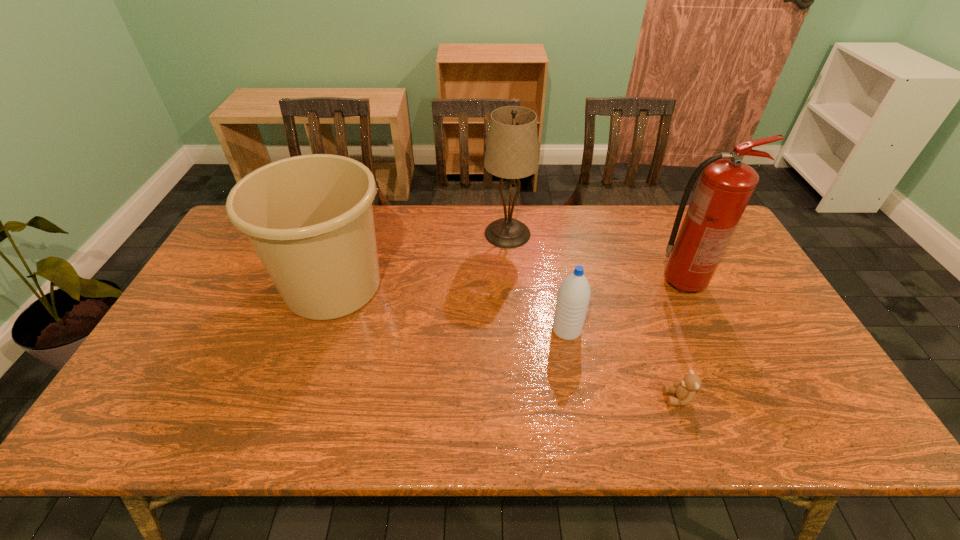
Locate an element on the screen. The height and width of the screenshot is (540, 960). object situated at the right edge is located at coordinates (726, 184).

Find the location of a particular element. vacant space at the far edge of the desktop is located at coordinates (530, 220).

Locate an element on the screen. vacant space at the near edge of the desktop is located at coordinates (516, 420).

Image resolution: width=960 pixels, height=540 pixels. In order to click on free point at the left edge in this screenshot , I will do `click(261, 265)`.

This screenshot has width=960, height=540. In the image, there is a desktop. Identify the location of free space at the right edge. (794, 372).

Find the location of a particular element. vacant space at the near left corner of the desktop is located at coordinates (148, 435).

The image size is (960, 540). I want to click on free space between the second object from left to right and the fourth tallest object, so click(x=538, y=282).

You are a GUI agent. You are given a task and a screenshot of the screen. Output one action in this format:
    pyautogui.click(x=<x>, y=<y>)
    Task: Click on the free space between the fourth object from right to left and the teddy bear
    
    Given the screenshot: What is the action you would take?
    pyautogui.click(x=593, y=316)

Identify the location of free space between the fire extinguisher and the water bottle. The image size is (960, 540). (624, 306).

The width and height of the screenshot is (960, 540). In order to click on vacant area that lies between the fourth object from right to left and the shortest object in this screenshot , I will do `click(593, 316)`.